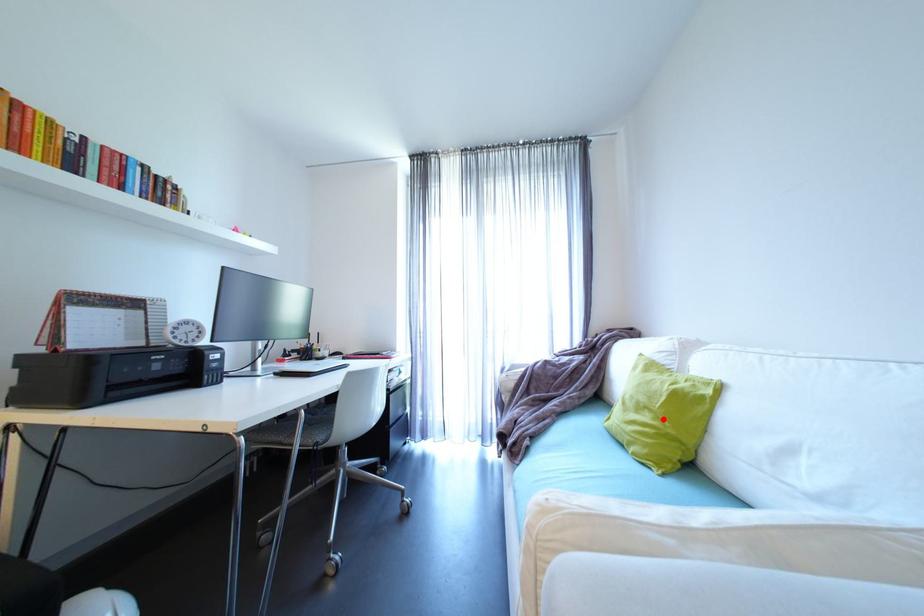
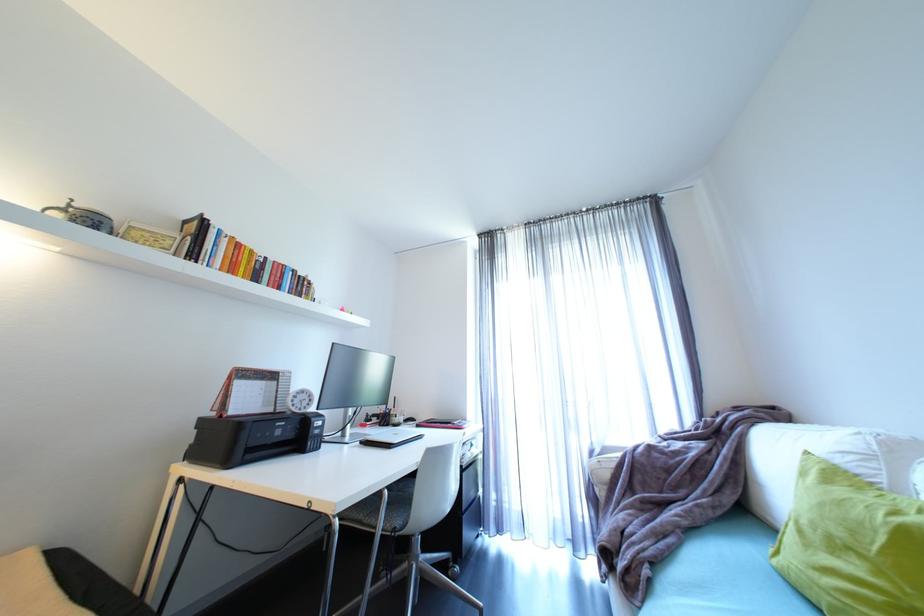
Locate, in the second image, the point that corresponds to the highlighted location in the first image.

(885, 573)